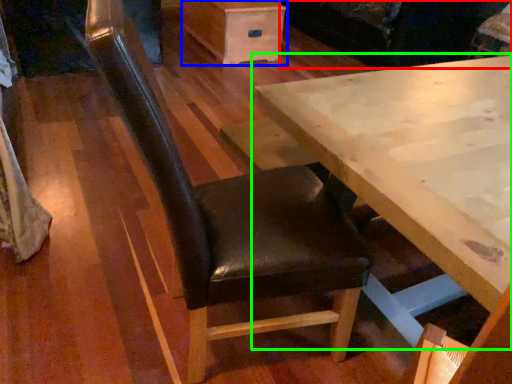
Question: Considering the real-world distances, which object is farthest from couch (highlighted by a red box)? drawer (highlighted by a blue box) or table (highlighted by a green box)?

Choices:
 (A) drawer
 (B) table

Answer: (B)